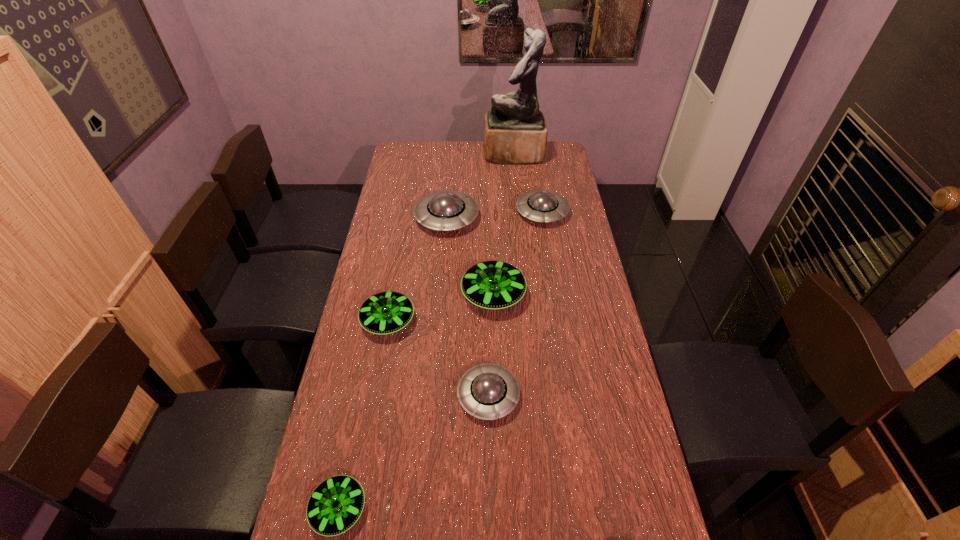
Locate which object is the closest to the biggest green saucer. Please provide its 2D coordinates. Your answer should be formatted as a tuple, i.e. [(x, y)], where the tuple contains the x and y coordinates of a point satisfying the conditions above.

[(387, 312)]

Find the location of `saucer that stands as the third closest to the farthest object`. saucer that stands as the third closest to the farthest object is located at coordinates (494, 285).

Select which saucer appears as the second closest to the nearest object. Please provide its 2D coordinates. Your answer should be formatted as a tuple, i.e. [(x, y)], where the tuple contains the x and y coordinates of a point satisfying the conditions above.

[(387, 312)]

Identify the location of gray saucer that is the second nearest to the rightmost green saucer. (488, 391).

Locate an element on the screen. gray saucer that is the nearest to the fifth farthest saucer is located at coordinates (446, 210).

Image resolution: width=960 pixels, height=540 pixels. I want to click on the closest green saucer to the rightmost green saucer, so click(387, 312).

Locate which green saucer is the second closest to the second smallest green saucer. Please provide its 2D coordinates. Your answer should be formatted as a tuple, i.e. [(x, y)], where the tuple contains the x and y coordinates of a point satisfying the conditions above.

[(336, 504)]

You are a GUI agent. You are given a task and a screenshot of the screen. Output one action in this format:
    pyautogui.click(x=<x>, y=<y>)
    Task: Click on the free point that satisfies the following two spatial constraints: 1. on the back side of the second biggest gray saucer; 2. on the right side of the second smallest green saucer
    
    Given the screenshot: What is the action you would take?
    pyautogui.click(x=408, y=213)